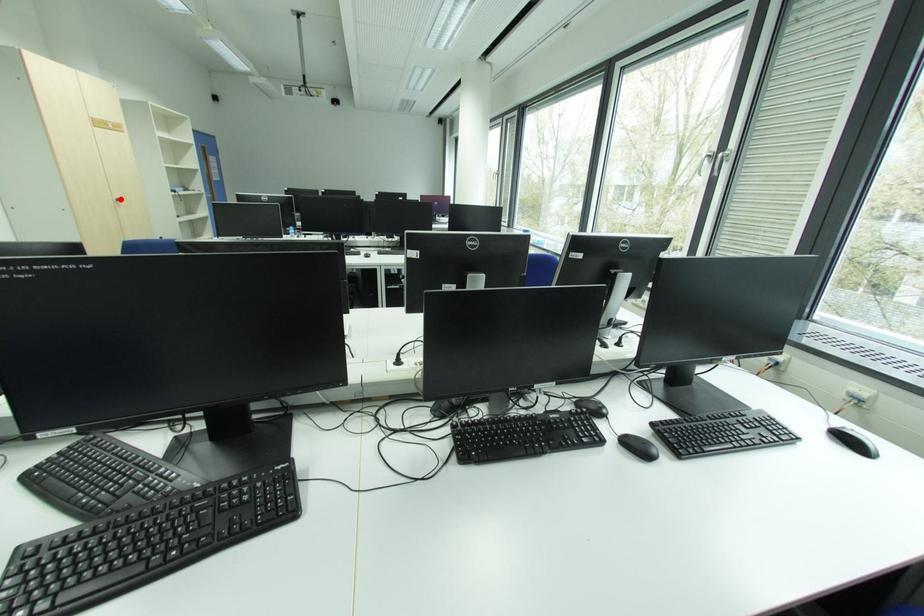
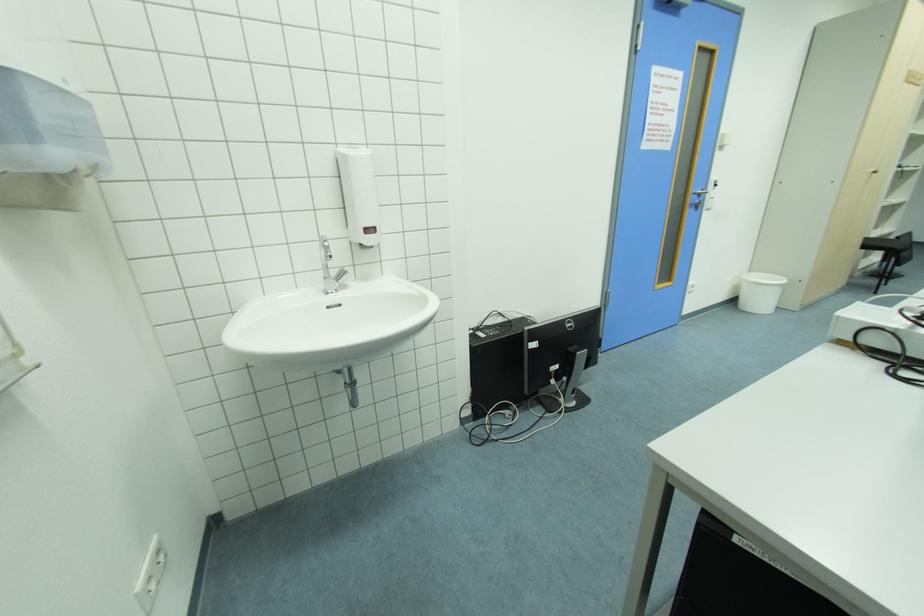
Question: I am providing you with two images of the same scene from different viewpoints. In image1, a red point is highlighted. Considering the same 3D point in image2, which of the following is correct?

Choices:
 (A) It is closer
 (B) It is farther

Answer: (B)